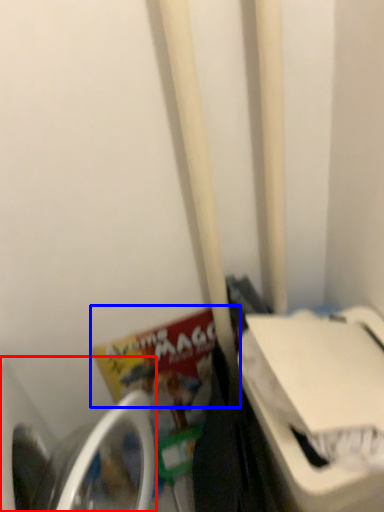
Question: Which point is further to the camera, washing machine (highlighted by a red box) or book (highlighted by a blue box)?

Choices:
 (A) washing machine
 (B) book

Answer: (B)